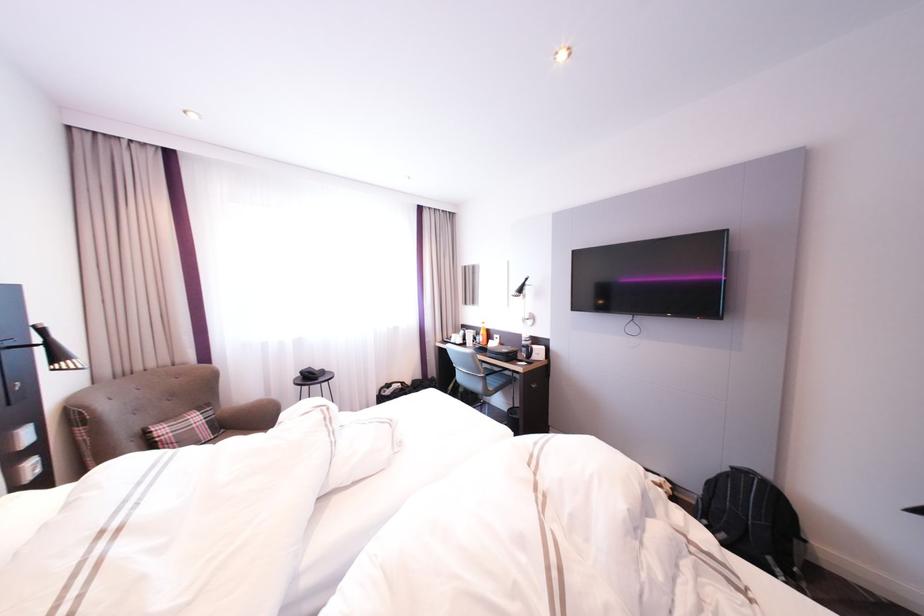
Image resolution: width=924 pixels, height=616 pixels. Identify the location of brown chair armrest. (249, 415).